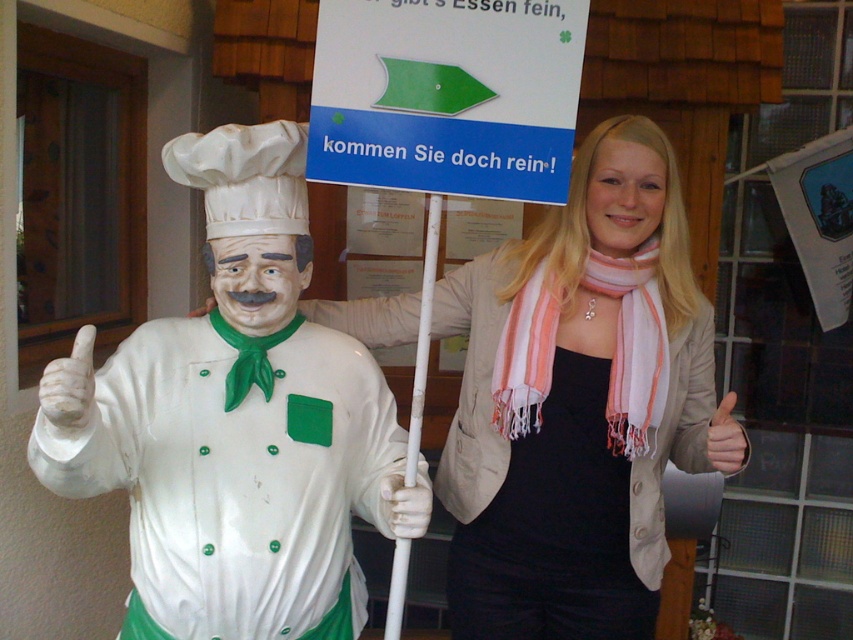
Who is lower down, white plastic sign at upper center or black matte dress at center?

black matte dress at center is below.

This screenshot has height=640, width=853. I want to click on white plastic sign at upper center, so click(447, 96).

The height and width of the screenshot is (640, 853). In order to click on white plastic sign at upper center in this screenshot , I will do `click(447, 96)`.

Is white glossy statue at left wider than matte beige jacket at center?

No, white glossy statue at left is not wider than matte beige jacket at center.

Does white glossy statue at left have a lesser width compared to matte beige jacket at center?

Indeed, white glossy statue at left has a lesser width compared to matte beige jacket at center.

Who is more forward, (x=248, y=392) or (x=648, y=209)?

Point (x=248, y=392)

Where is `white glossy statue at left`? Image resolution: width=853 pixels, height=640 pixels. white glossy statue at left is located at coordinates (238, 422).

Does matte beige jacket at center have a greater height compared to black matte dress at center?

Correct, matte beige jacket at center is much taller as black matte dress at center.

Can you confirm if matte beige jacket at center is positioned below black matte dress at center?

Incorrect, matte beige jacket at center is not positioned below black matte dress at center.

This screenshot has width=853, height=640. What do you see at coordinates (579, 403) in the screenshot?
I see `matte beige jacket at center` at bounding box center [579, 403].

Where is `matte beige jacket at center`? matte beige jacket at center is located at coordinates (579, 403).